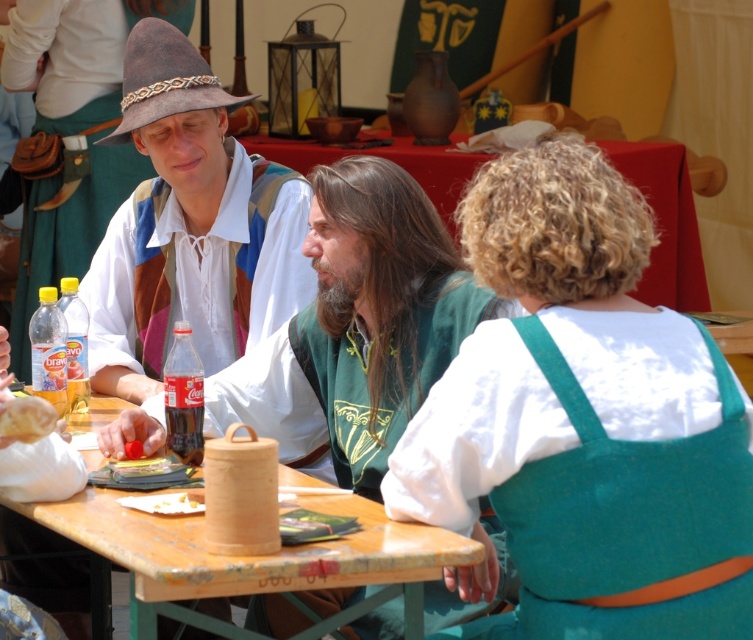
You are a participant at the Renaissance fair and want to adjust your costume. You have a matte brown hat at upper left and a white cotton apron at center. Which item is positioned to the right side of the other?

The matte brown hat at upper left is to the right of the white cotton apron at center.

You are standing 10 feet away from the point at coordinates point [136,353]. If you walk straight towards it, will you reach the point before walking 20 feet?

The distance of point [136,353] from viewer is 15.26 feet. Since you are currently 10 feet away from it, you only need to walk an additional 5.26 feet to reach the point before walking 20 feet.

Looking at this image, you are a vendor at the fair and need to place a decorative item on the table. The item requires a space that is wider than the matte brown hat at upper left. Can the white cotton apron at center provide enough width for this item?

The matte brown hat at upper left has a lesser width compared to white cotton apron at center, so the white cotton apron at center can provide enough width for the item since it is wider than the matte brown hat at upper left.